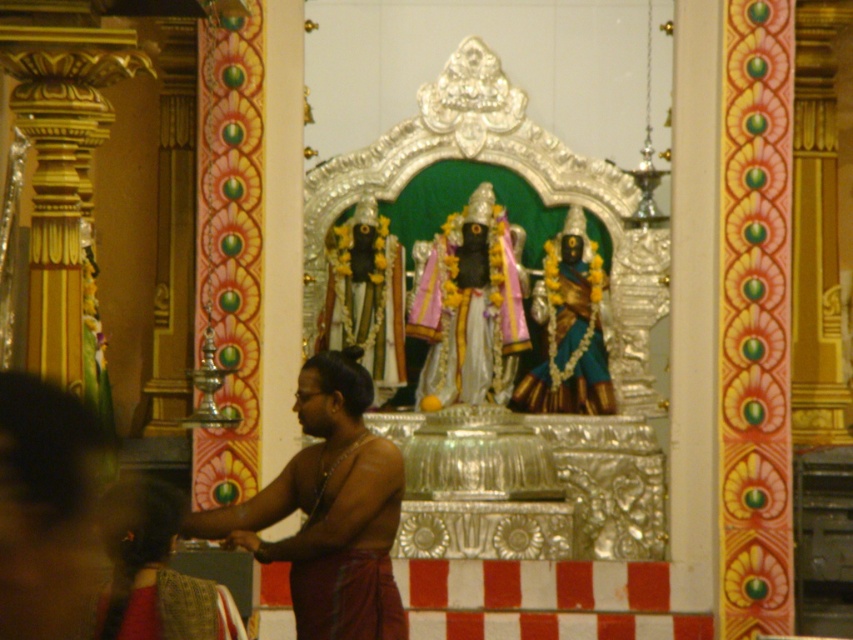
Is silky brown saree at lower left wider than silky red sari at lower left?

Correct, the width of silky brown saree at lower left exceeds that of silky red sari at lower left.

Which of these two, silky brown saree at lower left or silky red sari at lower left, stands shorter?

Standing shorter between the two is silky red sari at lower left.

Identify the location of silky brown saree at lower left. Image resolution: width=853 pixels, height=640 pixels. (161, 580).

I want to click on silky brown saree at lower left, so click(161, 580).

Is blue glossy statue at center wider than silky red sari at lower left?

No.

Identify the location of blue glossy statue at center. (569, 328).

This screenshot has height=640, width=853. Identify the location of blue glossy statue at center. (569, 328).

Is silky brown saree at lower left taller than blue glossy statue at center?

Indeed, silky brown saree at lower left has a greater height compared to blue glossy statue at center.

Is silky brown saree at lower left further to the viewer compared to blue glossy statue at center?

No, silky brown saree at lower left is in front of blue glossy statue at center.

Which is behind, point (206, 637) or point (589, 392)?

Point (589, 392)

The height and width of the screenshot is (640, 853). Find the location of `silky brown saree at lower left`. silky brown saree at lower left is located at coordinates (161, 580).